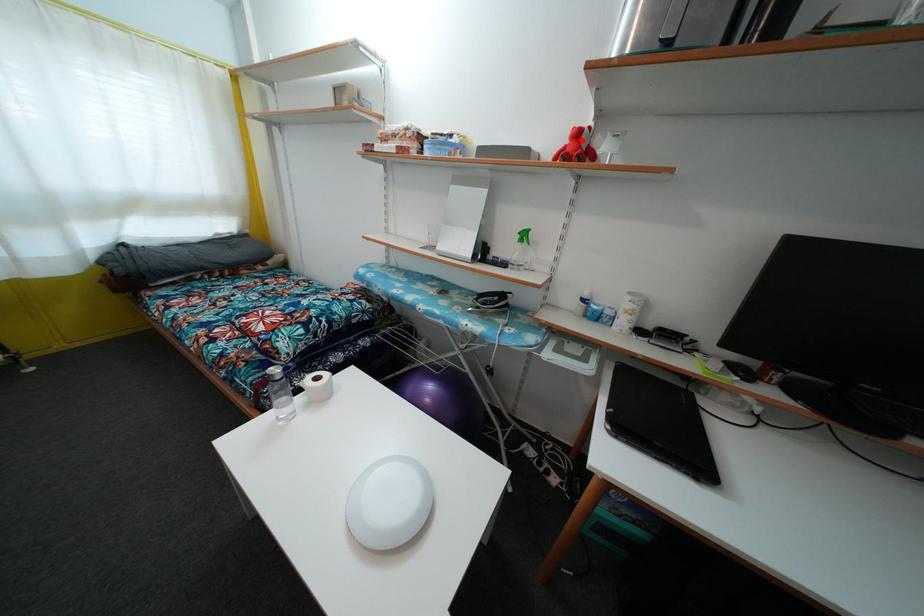
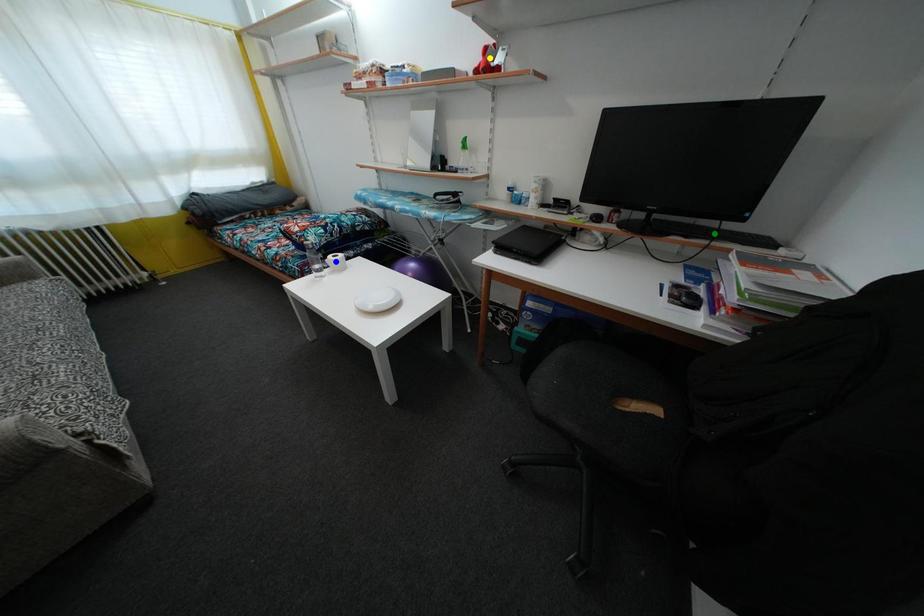
Question: I am providing you with two images of the same scene from different viewpoints. A red point is marked on the first image. You are given multiple points on the second image. Can you choose the point in image 2 that corresponds to the point in image 1?

Choices:
 (A) yellow point
 (B) blue point
 (C) green point

Answer: (A)